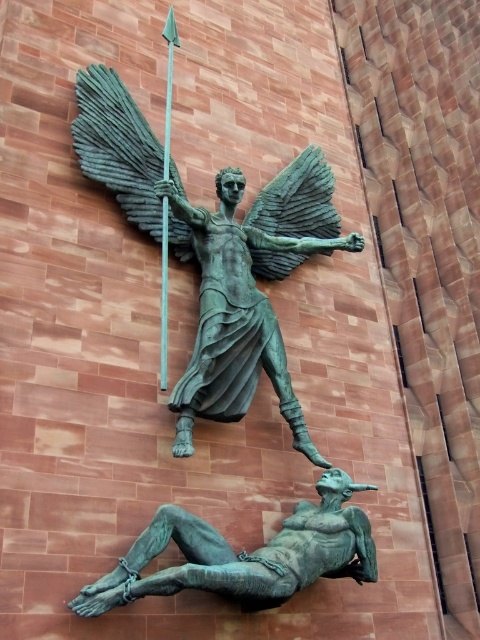
Question: Is bronze statue at upper center smaller than bronze figure at lower center?

Choices:
 (A) no
 (B) yes

Answer: (A)

Question: Considering the real-world distances, which object is closest to the green metallic spear at center?

Choices:
 (A) bronze statue at upper center
 (B) bronze figure at lower center

Answer: (A)

Question: Which object is the closest to the green metallic spear at center?

Choices:
 (A) bronze figure at lower center
 (B) bronze statue at upper center

Answer: (B)

Question: In this image, where is bronze statue at upper center located relative to bronze figure at lower center?

Choices:
 (A) right
 (B) left

Answer: (A)

Question: Estimate the real-world distances between objects in this image. Which object is farther from the bronze figure at lower center?

Choices:
 (A) green metallic spear at center
 (B) bronze statue at upper center

Answer: (A)

Question: From the image, what is the correct spatial relationship of bronze statue at upper center in relation to green metallic spear at center?

Choices:
 (A) left
 (B) right

Answer: (B)